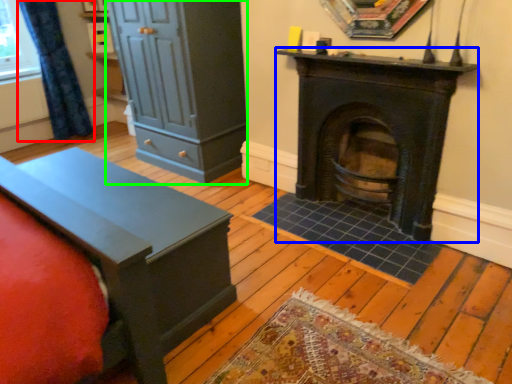
Question: Estimate the real-world distances between objects in this image. Which object is closer to curtain (highlighted by a red box), wood burning stove (highlighted by a blue box) or dresser (highlighted by a green box)?

Choices:
 (A) wood burning stove
 (B) dresser

Answer: (B)